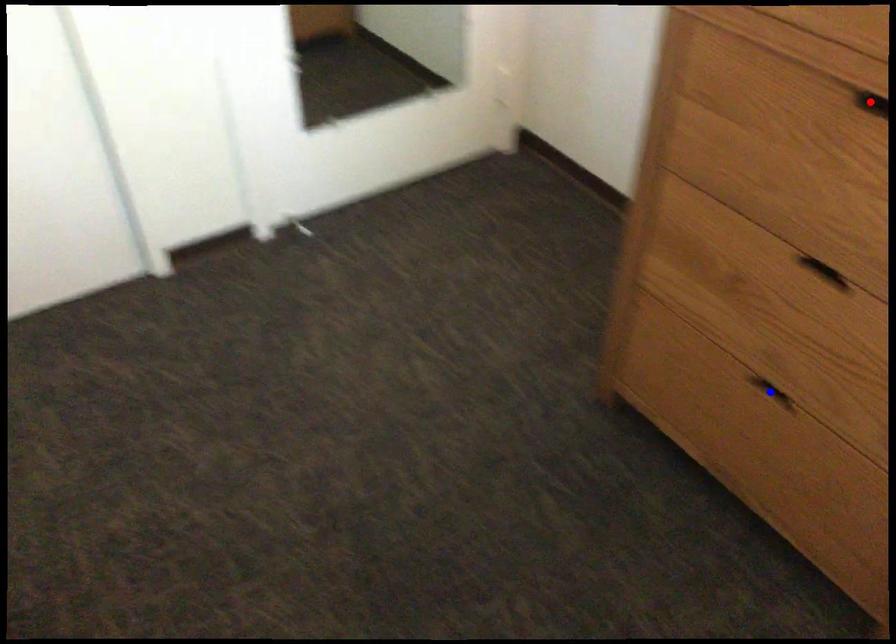
Question: Two points are marked on the image. Which point is closer to the camera?

Choices:
 (A) Blue point is closer.
 (B) Red point is closer.

Answer: (B)